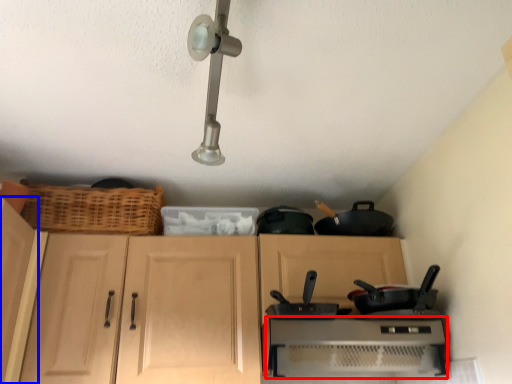
Question: Which object is closer to the camera taking this photo, home appliance (highlighted by a red box) or cabinetry (highlighted by a blue box)?

Choices:
 (A) home appliance
 (B) cabinetry

Answer: (B)